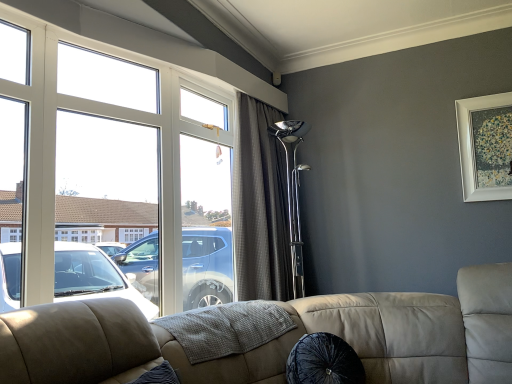
The width and height of the screenshot is (512, 384). Find the location of `gray textured curtain at upper right`. gray textured curtain at upper right is located at coordinates (260, 206).

Measure the distance between point (241, 136) and camera.

8.08 feet.

Image resolution: width=512 pixels, height=384 pixels. What do you see at coordinates (260, 206) in the screenshot?
I see `gray textured curtain at upper right` at bounding box center [260, 206].

At what (x,y) coordinates should I click in order to perform the action: click on gray textured curtain at upper right. Please return your answer as a coordinate pair (x, y). The height and width of the screenshot is (384, 512). Looking at the image, I should click on (260, 206).